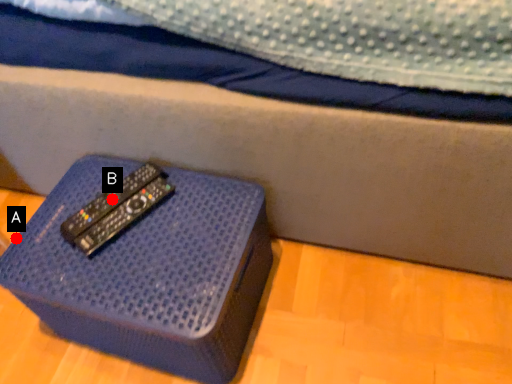
Question: Two points are circled on the image, labeled by A and B beside each circle. Which point is further to the camera?

Choices:
 (A) A is further
 (B) B is further

Answer: (B)